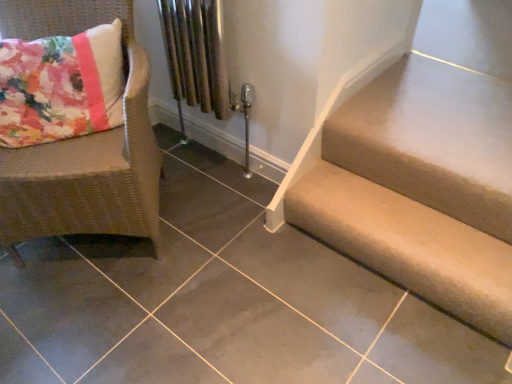
Describe the element at coordinates (83, 146) in the screenshot. I see `woven rattan chair at left` at that location.

Where is `woven rattan chair at left`? woven rattan chair at left is located at coordinates (83, 146).

Measure the distance between point (132,231) and camera.

A distance of 4.63 feet exists between point (132,231) and camera.

The image size is (512, 384). I want to click on beige fabric stairs at lower right, so tap(421, 188).

Describe the element at coordinates (421, 188) in the screenshot. The image size is (512, 384). I see `beige fabric stairs at lower right` at that location.

Find the location of a particular element. Image resolution: width=512 pixels, height=384 pixels. woven rattan chair at left is located at coordinates (83, 146).

Is woven rattan chair at left to the right of beige fabric stairs at lower right from the viewer's perspective?

In fact, woven rattan chair at left is to the left of beige fabric stairs at lower right.

Is woven rattan chair at left positioned in front of beige fabric stairs at lower right?

Yes, it is.

Which is nearer, [135,182] or [502,169]?

Point [135,182].

From the image's perspective, which one is positioned higher, woven rattan chair at left or beige fabric stairs at lower right?

From the image's view, woven rattan chair at left is above.

From a real-world perspective, is woven rattan chair at left on top of beige fabric stairs at lower right?

Yes, from a real-world perspective, woven rattan chair at left is on top of beige fabric stairs at lower right.

Between woven rattan chair at left and beige fabric stairs at lower right, which one has smaller width?

With smaller width is beige fabric stairs at lower right.

Who is shorter, woven rattan chair at left or beige fabric stairs at lower right?

beige fabric stairs at lower right.

Between woven rattan chair at left and beige fabric stairs at lower right, which one has smaller size?

With smaller size is beige fabric stairs at lower right.

Would you say woven rattan chair at left is outside beige fabric stairs at lower right?

Absolutely, woven rattan chair at left is external to beige fabric stairs at lower right.

Is woven rattan chair at left next to beige fabric stairs at lower right?

No, woven rattan chair at left is not in contact with beige fabric stairs at lower right.

Is woven rattan chair at left oriented away from beige fabric stairs at lower right?

woven rattan chair at left is not turned away from beige fabric stairs at lower right.

How many degrees apart are the facing directions of woven rattan chair at left and beige fabric stairs at lower right?

They differ by 43.7 degrees in their facing directions.

How distant is woven rattan chair at left from beige fabric stairs at lower right?

32.22 inches.

The height and width of the screenshot is (384, 512). I want to click on chair above the beige fabric stairs at lower right (from a real-world perspective), so click(x=83, y=146).

Between beige fabric stairs at lower right and woven rattan chair at left, which one appears on the left side from the viewer's perspective?

Positioned to the left is woven rattan chair at left.

Considering their positions, is beige fabric stairs at lower right located in front of or behind woven rattan chair at left?

Visually, beige fabric stairs at lower right is located behind woven rattan chair at left.

Considering the positions of point (487, 167) and point (148, 163), is point (487, 167) closer or farther from the camera than point (148, 163)?

Point (487, 167) is positioned farther from the camera compared to point (148, 163).

From the image's perspective, which is below, beige fabric stairs at lower right or woven rattan chair at left?

beige fabric stairs at lower right is shown below in the image.

From a real-world perspective, who is located higher, beige fabric stairs at lower right or woven rattan chair at left?

woven rattan chair at left is physically above.

In the scene shown: Is beige fabric stairs at lower right thinner than woven rattan chair at left?

Yes.

Is beige fabric stairs at lower right shorter than woven rattan chair at left?

Yes, beige fabric stairs at lower right is shorter than woven rattan chair at left.

Who is bigger, beige fabric stairs at lower right or woven rattan chair at left?

woven rattan chair at left is bigger.

Is beige fabric stairs at lower right inside the boundaries of woven rattan chair at left, or outside?

beige fabric stairs at lower right exists outside the volume of woven rattan chair at left.

Is beige fabric stairs at lower right placed right next to woven rattan chair at left?

No, beige fabric stairs at lower right is not making contact with woven rattan chair at left.

Is beige fabric stairs at lower right facing towards woven rattan chair at left?

No, beige fabric stairs at lower right is not aimed at woven rattan chair at left.

Where is `stairs below the woven rattan chair at left (from the image's perspective)`? This screenshot has height=384, width=512. stairs below the woven rattan chair at left (from the image's perspective) is located at coordinates (421, 188).

At what (x,y) coordinates should I click in order to perform the action: click on stairs on the right of the woven rattan chair at left. Please return your answer as a coordinate pair (x, y). Looking at the image, I should click on (421, 188).

Find the location of a particular element. This screenshot has width=512, height=384. chair above the beige fabric stairs at lower right (from a real-world perspective) is located at coordinates (83, 146).